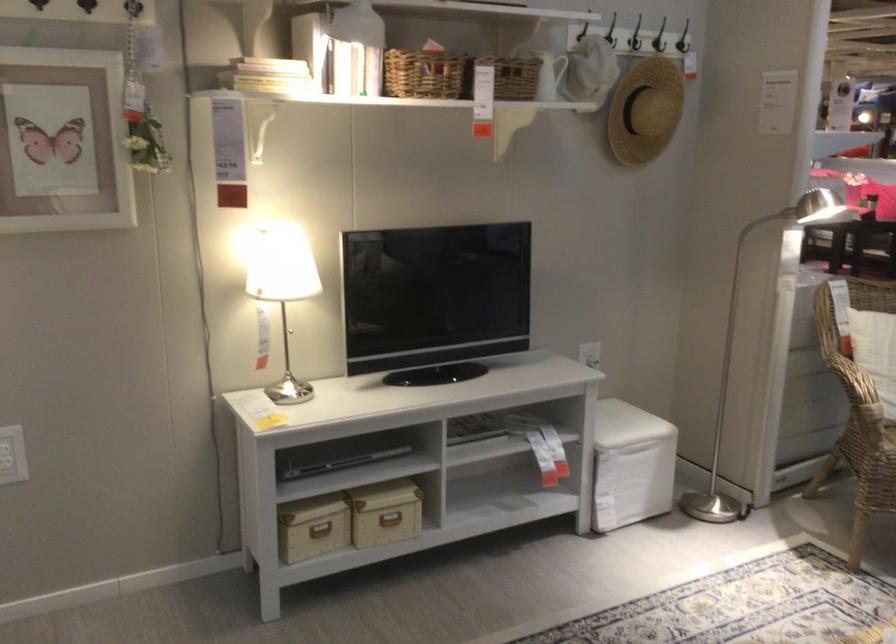
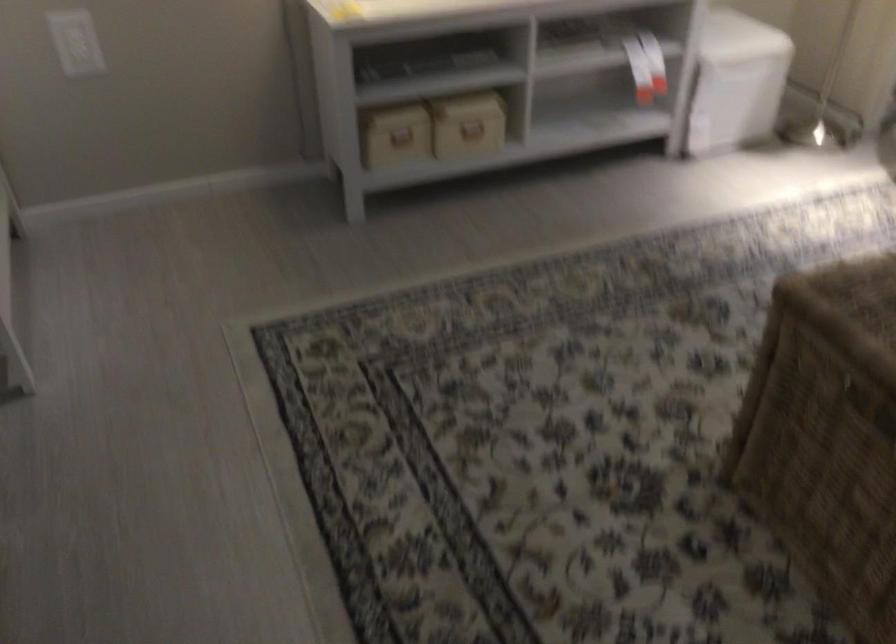
Locate, in the second image, the point that corresponds to point (320, 532) in the first image.

(401, 136)